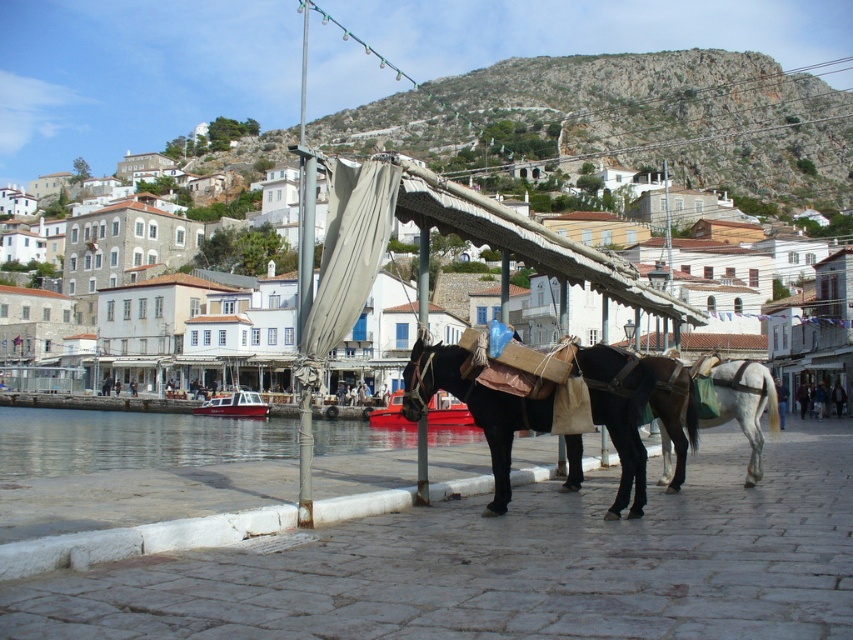
Question: Which point is closer to the camera?

Choices:
 (A) red glossy boat at center
 (B) black glossy horse at center
 (C) white fabric canopy at center

Answer: (C)

Question: Observing the image, what is the correct spatial positioning of white matte building at center in reference to white fabric canopy at center?

Choices:
 (A) above
 (B) below

Answer: (A)

Question: Among these objects, which one is farthest from the camera?

Choices:
 (A) clear water at lower left
 (B) white glossy horse at right
 (C) white fabric canopy at center

Answer: (A)

Question: Which object is the farthest from the white fabric canopy at center?

Choices:
 (A) black glossy horse at center
 (B) white matte building at center

Answer: (B)

Question: Can you confirm if white fabric canopy at center is bigger than red glossy boat at center?

Choices:
 (A) yes
 (B) no

Answer: (A)

Question: Is clear water at lower left above white glossy horse at right?

Choices:
 (A) yes
 (B) no

Answer: (B)